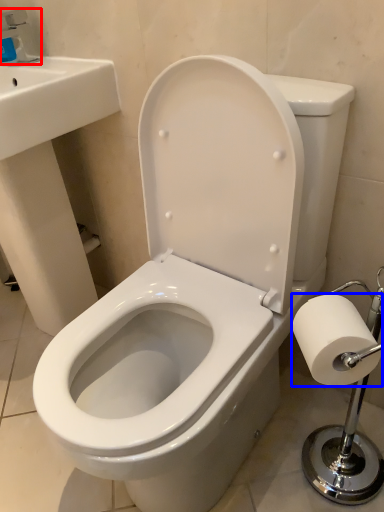
Question: Which of the following is the farthest to the observer, faucet (highlighted by a red box) or toilet paper (highlighted by a blue box)?

Choices:
 (A) faucet
 (B) toilet paper

Answer: (A)